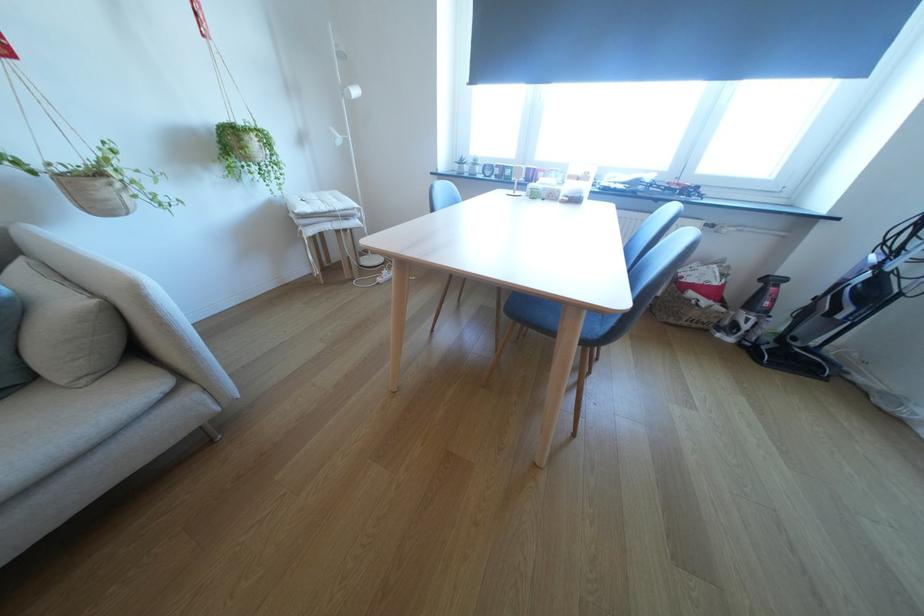
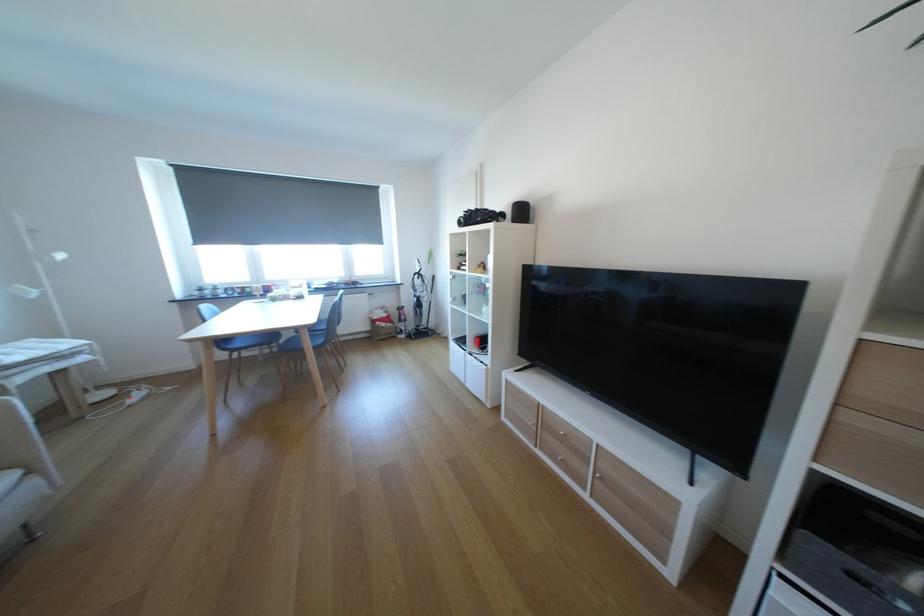
Where in the second image is the point corresponding to point 353,132 from the first image?

(47, 286)